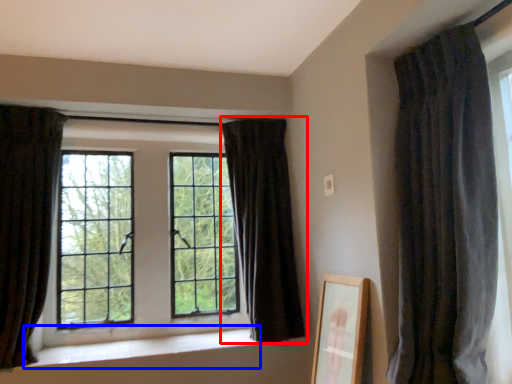
Question: Which object appears closest to the camera in this image, curtain (highlighted by a red box) or window sill (highlighted by a blue box)?

Choices:
 (A) curtain
 (B) window sill

Answer: (B)